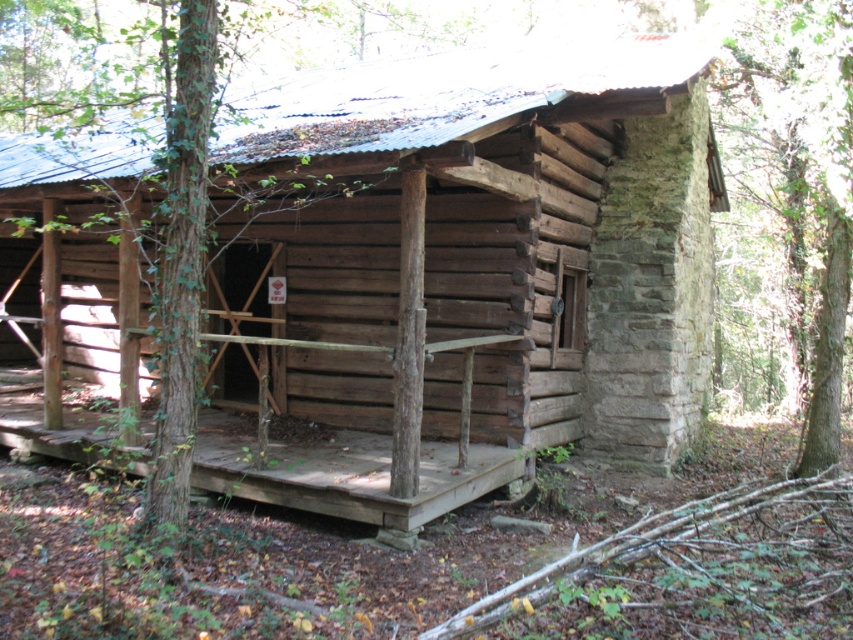
Question: Is weathered wood cabin at center above green leafy tree at right?

Choices:
 (A) yes
 (B) no

Answer: (B)

Question: Which point is closer to the camera?

Choices:
 (A) weathered wood cabin at center
 (B) green leafy tree at right
 (C) weathered wood porch at center

Answer: (C)

Question: Can you confirm if weathered wood cabin at center is positioned above weathered wood porch at center?

Choices:
 (A) yes
 (B) no

Answer: (A)

Question: Which object is positioned closest to the weathered wood porch at center?

Choices:
 (A) weathered wood cabin at center
 (B) green leafy tree at right

Answer: (A)

Question: Which point is closer to the camera?

Choices:
 (A) weathered wood porch at center
 (B) green leafy tree at right
 (C) weathered wood cabin at center

Answer: (A)

Question: Considering the relative positions of weathered wood cabin at center and weathered wood porch at center in the image provided, where is weathered wood cabin at center located with respect to weathered wood porch at center?

Choices:
 (A) above
 (B) below

Answer: (A)